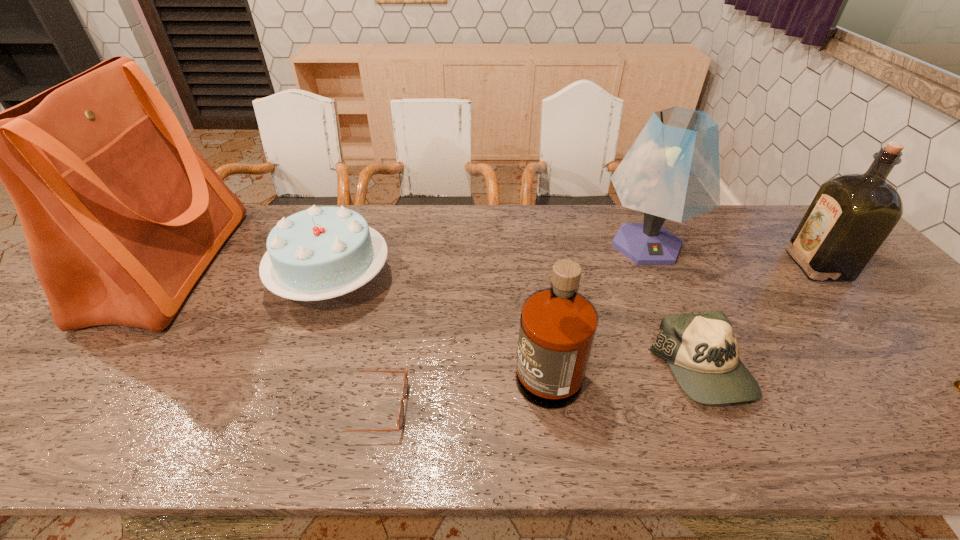
The image size is (960, 540). Find the location of `free space located 0.110m on the base of the lampshade`. free space located 0.110m on the base of the lampshade is located at coordinates (675, 306).

At what (x,y) coordinates should I click in order to perform the action: click on free space located on the label of the right liquor. Please return your answer as a coordinate pair (x, y). Looking at the image, I should click on (665, 265).

Locate an element on the screen. This screenshot has width=960, height=540. vacant area situated 0.090m on the label of the right liquor is located at coordinates (764, 265).

The image size is (960, 540). In order to click on vacant space situated on the label of the right liquor in this screenshot , I will do `click(718, 265)`.

The width and height of the screenshot is (960, 540). What are the coordinates of `vacant region located on the front label of the nearer liquor` in the screenshot? It's located at (431, 360).

Where is `vacant space located on the front label of the nearer liquor`? The width and height of the screenshot is (960, 540). vacant space located on the front label of the nearer liquor is located at coordinates (348, 360).

Identify the location of free space located on the front label of the nearer liquor. This screenshot has height=540, width=960. (426, 360).

Where is `free space located on the front of the fifth tallest object`? Image resolution: width=960 pixels, height=540 pixels. free space located on the front of the fifth tallest object is located at coordinates (302, 361).

Where is `blank space located on the front-facing side of the sunglasses`? This screenshot has height=540, width=960. blank space located on the front-facing side of the sunglasses is located at coordinates (492, 408).

The width and height of the screenshot is (960, 540). Identify the location of shopping bag present at the far edge. (121, 213).